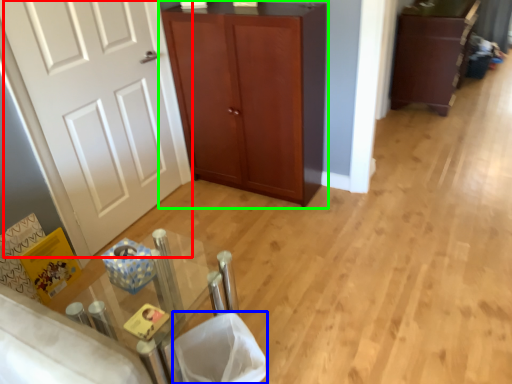
Question: Which is farther away from door (highlighted by a red box)? laundry basket (highlighted by a blue box) or cupboard (highlighted by a green box)?

Choices:
 (A) laundry basket
 (B) cupboard

Answer: (A)